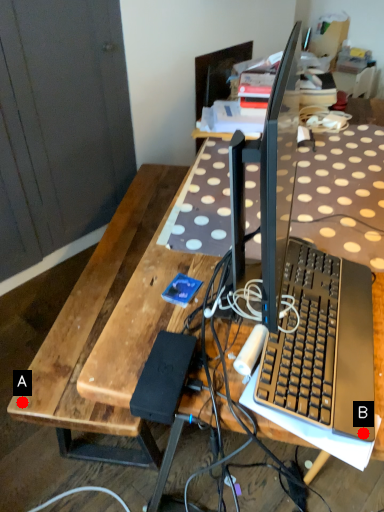
Question: Two points are circled on the image, labeled by A and B beside each circle. Which point appears closest to the camera in this image?

Choices:
 (A) A is closer
 (B) B is closer

Answer: (B)